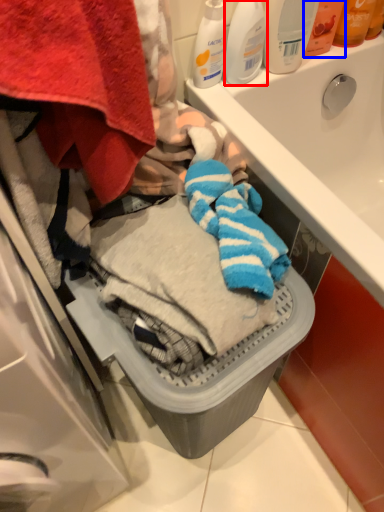
Question: Among these objects, which one is nearest to the camera, cleaning product (highlighted by a red box) or toiletry (highlighted by a blue box)?

Choices:
 (A) cleaning product
 (B) toiletry

Answer: (A)